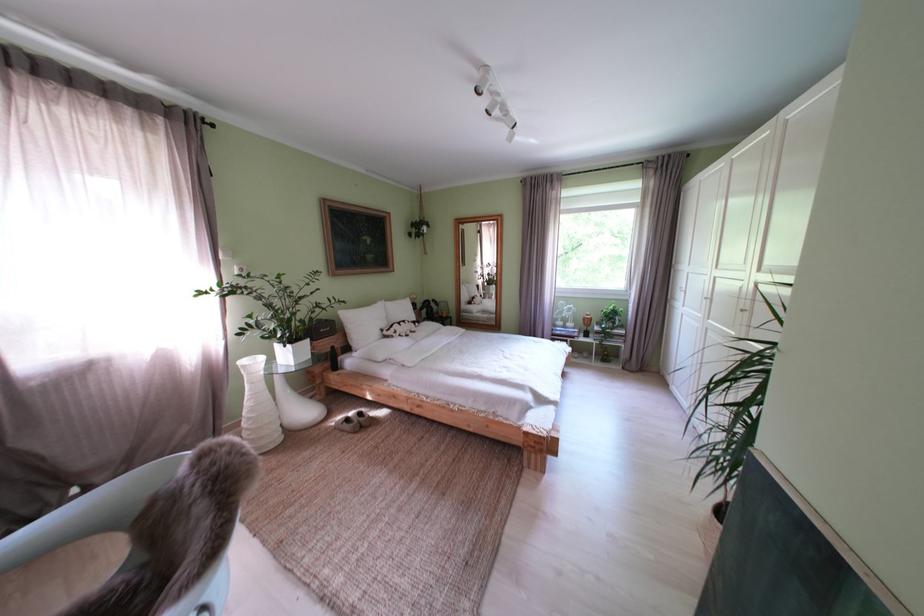
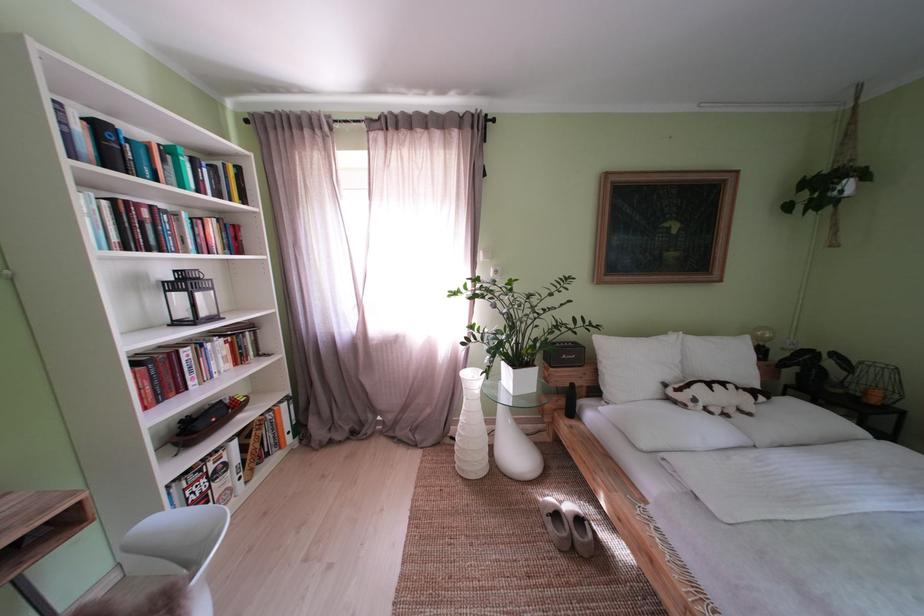
Where in the second image is the point corresponding to the point at 359,424 from the first image?

(567, 521)